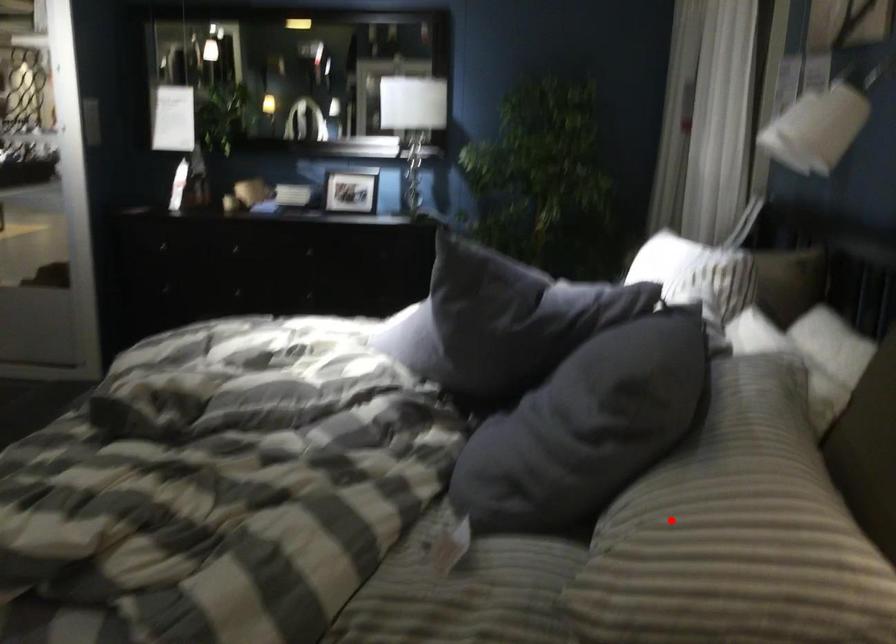
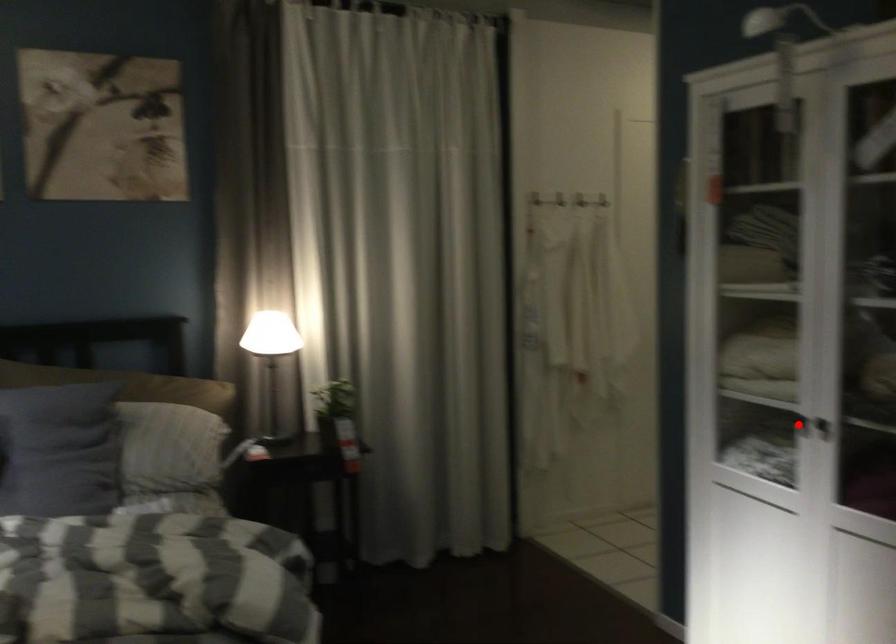
I am providing you with two images of the same scene from different viewpoints. A red point is marked on the first image and another point is marked on the second image. Are the points marked in image1 and image2 representing the same 3D position?

No